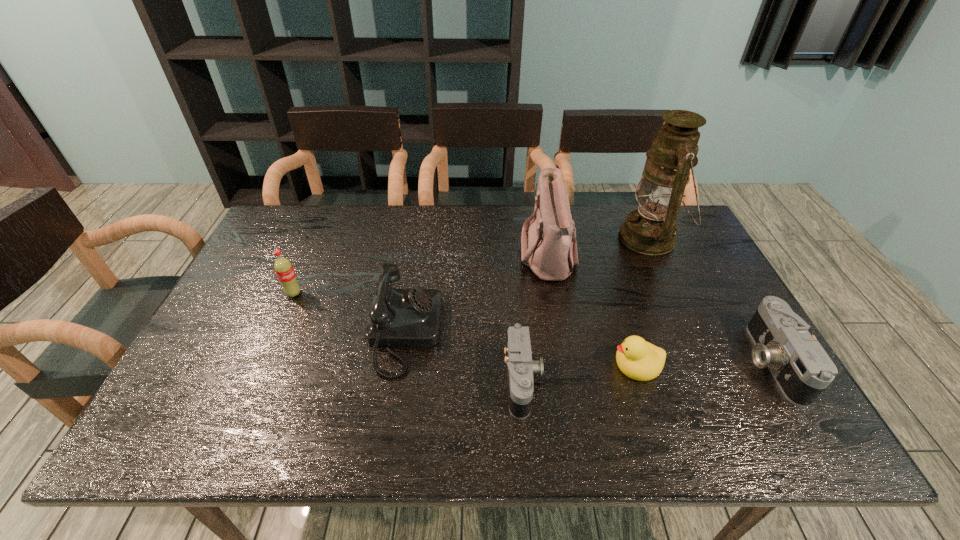
At what (x,y) coordinates should I click in order to perform the action: click on object located in the near right corner section of the desktop. Please return your answer as a coordinate pair (x, y). Image resolution: width=960 pixels, height=540 pixels. Looking at the image, I should click on (802, 369).

Locate an element on the screen. This screenshot has height=540, width=960. free space at the far edge of the desktop is located at coordinates (387, 231).

In the image, there is a desktop. Identify the location of free space at the near edge. This screenshot has width=960, height=540. (327, 375).

Identify the location of vacant space at the left edge. (258, 287).

This screenshot has height=540, width=960. What are the coordinates of `free space at the right edge of the desktop` in the screenshot? It's located at (702, 329).

I want to click on vacant area at the far left corner, so click(x=303, y=222).

The width and height of the screenshot is (960, 540). I want to click on vacant point located between the sixth object from right to left and the tallest object, so click(x=527, y=286).

You are a GUI agent. You are given a task and a screenshot of the screen. Output one action in this format:
    pyautogui.click(x=<x>, y=<y>)
    Task: Click on the free space between the oil lamp and the left camera
    
    Given the screenshot: What is the action you would take?
    pyautogui.click(x=587, y=309)

The image size is (960, 540). In order to click on free space between the tallest object and the fifth tallest object in this screenshot , I will do click(710, 300).

This screenshot has width=960, height=540. I want to click on free point between the shorter camera and the sixth shortest object, so click(536, 319).